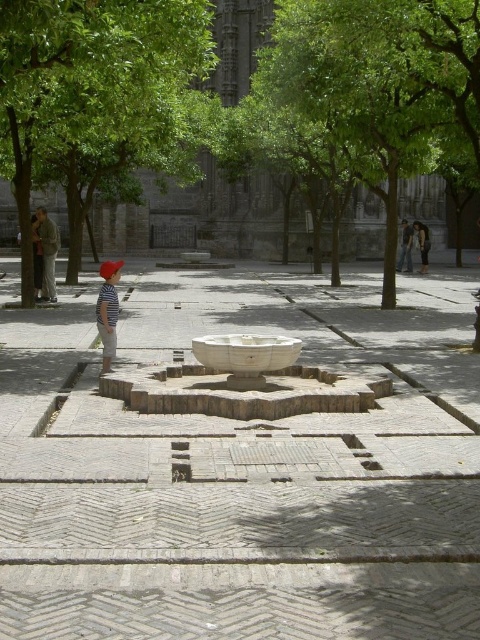
You are standing at the center of the plaza and want to take a photo of the green leafy tree at center. Which direction should you face to ensure the tree is in the center of your camera view?

You should face north because the green leafy tree at center is located at point coordinates north of your current position.

You are standing in the plaza and want to pick up the denim jacket at center. Which direction should you move to reach it first, considering the position of the matte gray statue at left?

The matte gray statue at left is located above the denim jacket at center. To reach the denim jacket at center, you should move downward from the statue.

You are standing at the edge of the plaza and want to pick up the denim jacket at center. Is the matte gray statue at left blocking your path?

The matte gray statue at left is closer to you than the denim jacket at center, so it is blocking your path to the denim jacket at center.